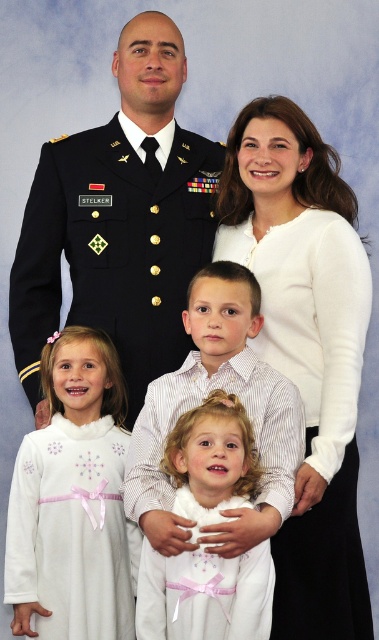
Can you confirm if dark blue uniform at upper left is bigger than white satin dress at lower left?

Correct, dark blue uniform at upper left is larger in size than white satin dress at lower left.

Locate an element on the screen. The image size is (379, 640). dark blue uniform at upper left is located at coordinates (120, 220).

This screenshot has height=640, width=379. Describe the element at coordinates (120, 220) in the screenshot. I see `dark blue uniform at upper left` at that location.

Identify the location of dark blue uniform at upper left. The height and width of the screenshot is (640, 379). (120, 220).

Which is behind, point (330, 300) or point (189, 598)?

Point (330, 300)

Which is in front, point (258, 100) or point (178, 620)?

Positioned in front is point (178, 620).

Locate an element on the screen. Image resolution: width=379 pixels, height=640 pixels. white smooth sweater at upper center is located at coordinates (305, 348).

Is white satin dress at lower left behind white satin dress at lower center?

Yes, it is.

Between point (78, 380) and point (189, 593), which one is positioned in front?

Point (189, 593) is in front.

You are a GUI agent. You are given a task and a screenshot of the screen. Output one action in this format:
    pyautogui.click(x=<x>, y=<y>)
    Task: Click on the white satin dress at lower left
    
    Given the screenshot: What is the action you would take?
    pyautogui.click(x=73, y=500)